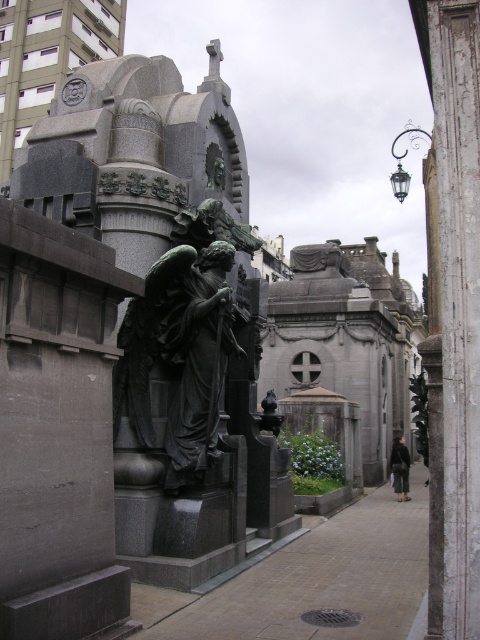
You are a visitor to the cemetery and want to place a bouquet of flowers between the smooth concrete pavement at center and the bronze statue at center. Based on their positions, where should you place the bouquet?

The smooth concrete pavement at center is in front of the bronze statue at center, so you should place the bouquet between the smooth concrete pavement at center and the bronze statue at center by positioning it on the pavement in front of the statue.

You are a visitor at the cemetery and want to take a photo of the bronze statue at center without the smooth concrete pavement at center appearing in the background. Is it possible to do so by adjusting your camera angle?

The smooth concrete pavement at center is shorter than the bronze statue at center, so by positioning the camera at a higher angle or moving to a higher vantage point, you can frame the shot to exclude the pavement from the background.